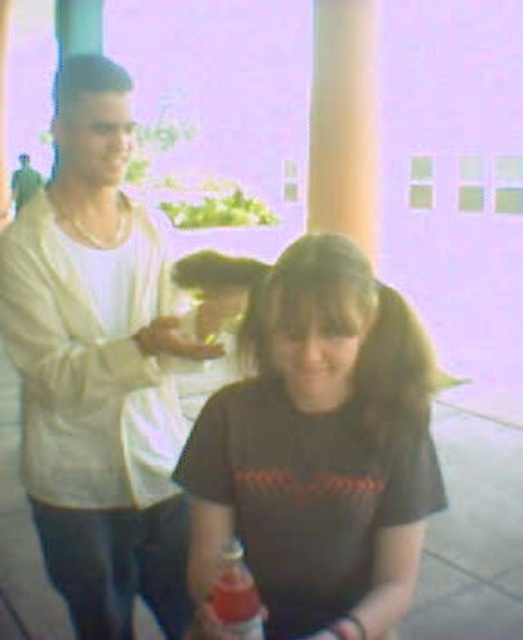
Which of these two, matte black shirt at center or dark brown t-shirt at center, stands shorter?

Standing shorter between the two is dark brown t-shirt at center.

Describe the element at coordinates (98, 369) in the screenshot. I see `matte black shirt at center` at that location.

Who is more forward, (100, 148) or (362, 541)?

Point (362, 541) is in front.

Locate an element on the screen. The height and width of the screenshot is (640, 523). matte black shirt at center is located at coordinates (98, 369).

Between translucent plastic bottle at center and matte white shirt at center, which one is positioned higher?

matte white shirt at center

Is translucent plastic bottle at center shorter than matte white shirt at center?

Correct, translucent plastic bottle at center is not as tall as matte white shirt at center.

Between point (240, 550) and point (38, 177), which one is positioned behind?

Point (38, 177)

The width and height of the screenshot is (523, 640). I want to click on translucent plastic bottle at center, so click(x=235, y=596).

Does point (468, 605) come closer to viewer compared to point (251, 616)?

No, it is behind (251, 616).

Image resolution: width=523 pixels, height=640 pixels. In order to click on smooth concrete pavement at center in this screenshot , I will do `click(473, 534)`.

What do you see at coordinates (473, 534) in the screenshot? This screenshot has width=523, height=640. I see `smooth concrete pavement at center` at bounding box center [473, 534].

The image size is (523, 640). I want to click on smooth concrete pavement at center, so click(x=473, y=534).